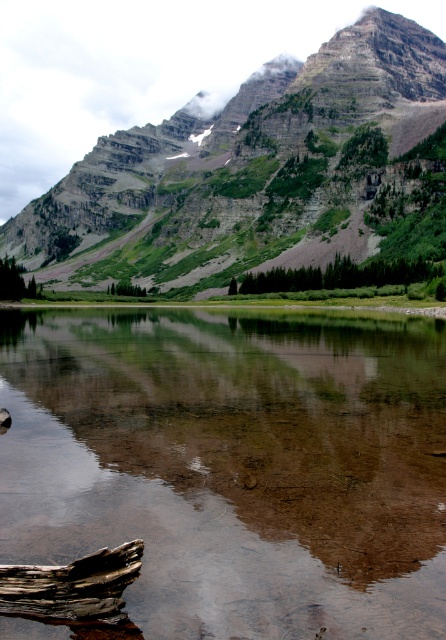
Looking at this image, you are planning to cross the water using the brown wood log at lower left and the green leafy trees at center. Which object is narrower and thus safer to step on?

The brown wood log at lower left has a lesser width compared to green leafy trees at center, so it is narrower and safer to step on.

You are a hiker standing at the base of the green matte tree at center and want to reach the green rock mountain at upper center. Which direction should you head to move towards it?

The green rock mountain at upper center is positioned on the right side of the green matte tree at center, so you should head to the right to move towards it.

Consider the image. You are a hiker standing at the origin point of the coordinate system. You want to reach the clear water at center. What are the coordinates you need to move to?

The coordinates you need to move to are 0.727 in the x direction and 0.525 in the y direction to reach the clear water at center.